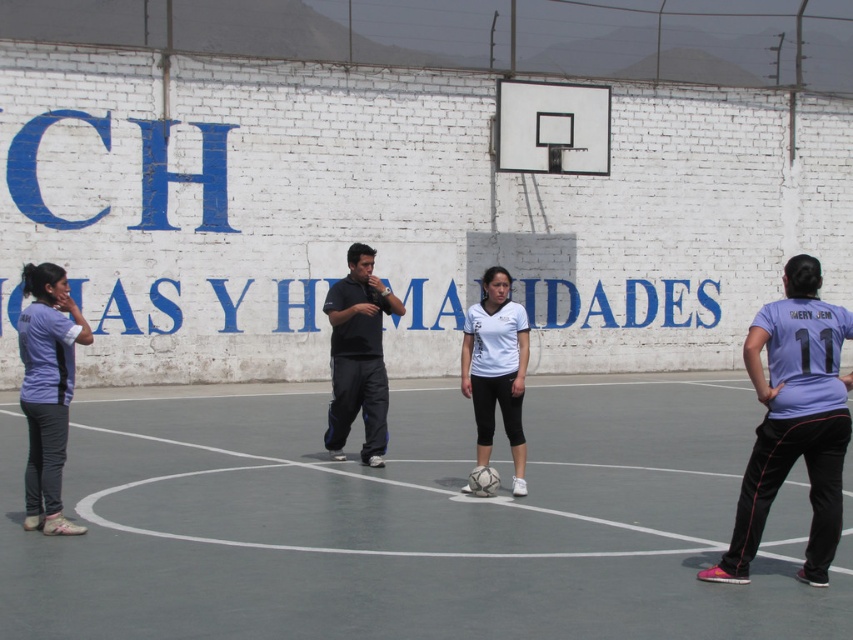
You are a photographer trying to capture a wide shot of the scene. The black matte shirt at center and the white matte soccer ball at center are both in the center. Which object is wider?

The black matte shirt at center might be wider than white matte soccer ball at center.

You are a photographer taking a picture of the black matte shirt at center and the white matte soccer ball at center. Which object should you focus on first if you want the larger one to be in sharp focus?

The black matte shirt at center is bigger than the white matte soccer ball at center, so you should focus on the black matte shirt at center first to ensure it is in sharp focus.